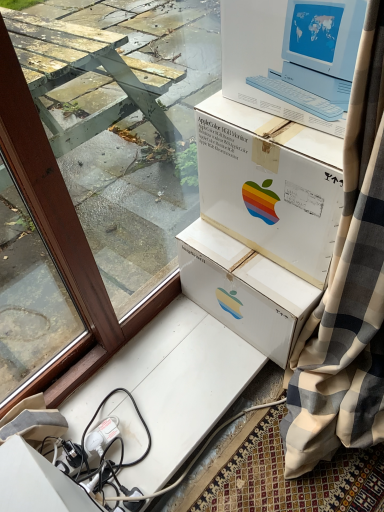
Question: Is white plastic apple monitor at upper center taller or shorter than brown wood window frame at upper left?

Choices:
 (A) tall
 (B) short

Answer: (B)

Question: Relative to brown wood window frame at upper left, is white plastic apple monitor at upper center in front or behind?

Choices:
 (A) front
 (B) behind

Answer: (B)

Question: Estimate the real-world distances between objects in this image. Which object is closer to the white plastic apple monitor at upper center?

Choices:
 (A) brown wood window frame at upper left
 (B) white cardboard box at upper center

Answer: (B)

Question: Which of these objects is positioned farthest from the white cardboard box at upper center?

Choices:
 (A) white plastic apple monitor at upper center
 (B) brown wood window frame at upper left

Answer: (B)